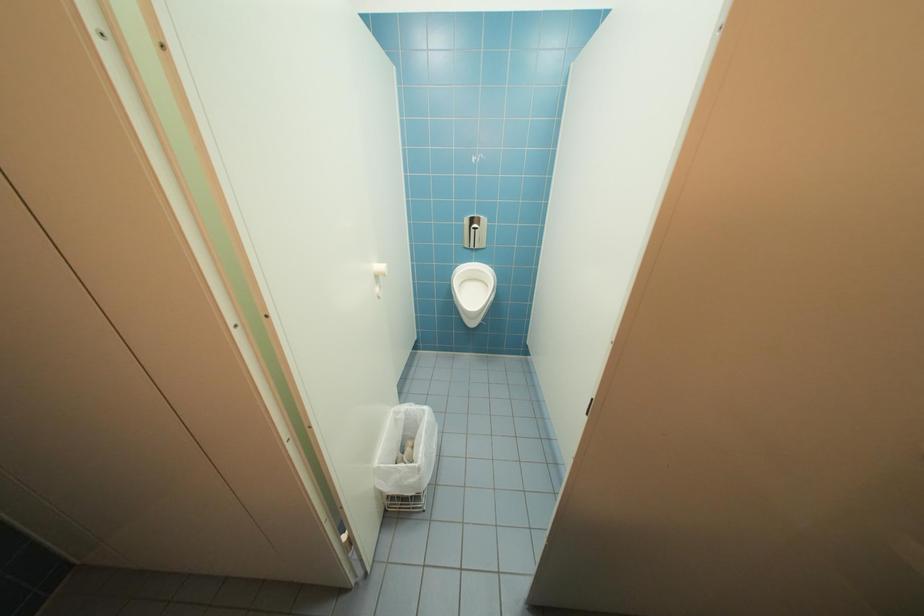
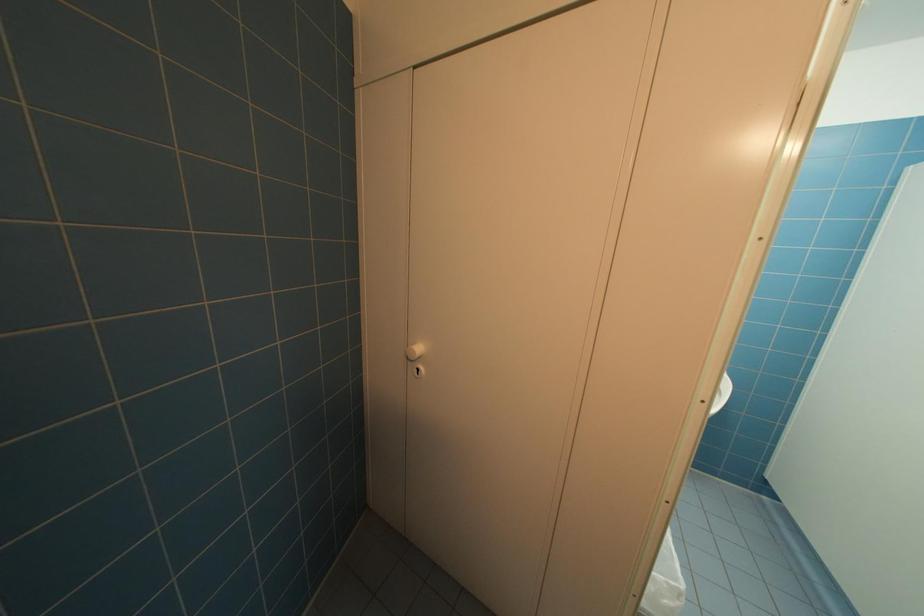
Question: Based on the continuous images, in which direction is the camera rotating? Reply with the corresponding letter.

Choices:
 (A) Left
 (B) Right
 (C) Up
 (D) Down

Answer: (A)